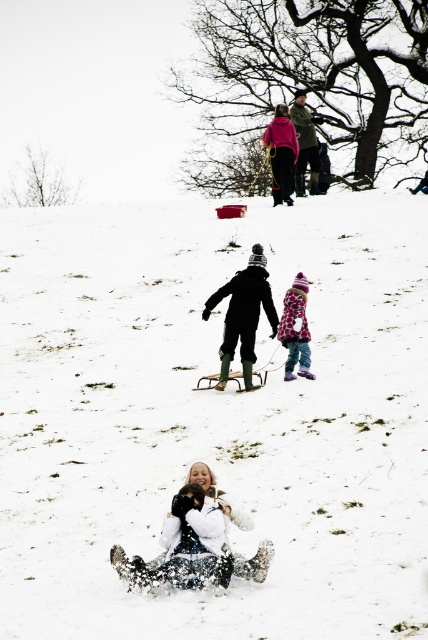
Based on the photo, who is taller, black rubber boots at center or pink fleece jacket at upper center?

Standing taller between the two is black rubber boots at center.

Can you confirm if black rubber boots at center is taller than pink fleece jacket at upper center?

Correct, black rubber boots at center is much taller as pink fleece jacket at upper center.

The height and width of the screenshot is (640, 428). I want to click on black rubber boots at center, so click(x=243, y=314).

From the picture: Is black rubber boots at center in front of dark green jacket at upper center?

Yes, black rubber boots at center is in front of dark green jacket at upper center.

Is black rubber boots at center further to camera compared to dark green jacket at upper center?

That is False.

Describe the element at coordinates (243, 314) in the screenshot. I see `black rubber boots at center` at that location.

Identify the location of black rubber boots at center. This screenshot has width=428, height=640. (243, 314).

Does plaid fabric coat at center have a greater width compared to pink fleece jacket at upper center?

Incorrect, plaid fabric coat at center's width does not surpass pink fleece jacket at upper center's.

Which is above, plaid fabric coat at center or pink fleece jacket at upper center?

pink fleece jacket at upper center is above.

What are the coordinates of `plaid fabric coat at center` in the screenshot? It's located at (296, 328).

In order to click on plaid fabric coat at center in this screenshot , I will do `click(296, 328)`.